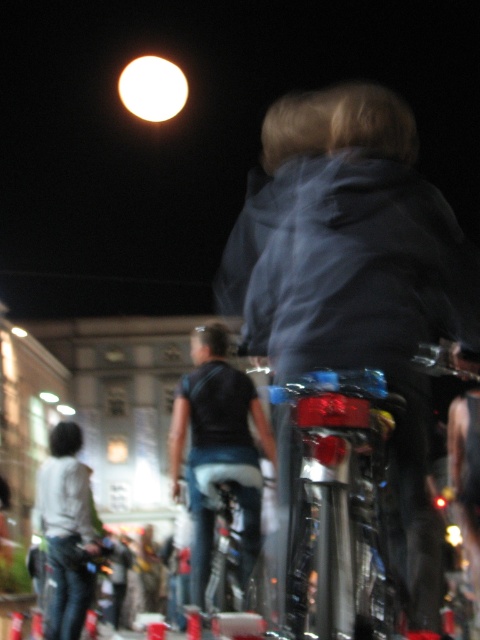
Does point (300, 134) lie behind point (252, 545)?

No, (300, 134) is in front of (252, 545).

Who is higher up, dark blue fabric jacket at center or black matte shirt at center?

dark blue fabric jacket at center is higher up.

Is point (464, 340) positioned behind point (263, 444)?

No, (464, 340) is closer to viewer.

Where is `dark blue fabric jacket at center`? This screenshot has height=640, width=480. dark blue fabric jacket at center is located at coordinates (356, 280).

Does dark blue fabric jacket at center have a lesser height compared to white matte shirt at lower left?

In fact, dark blue fabric jacket at center may be taller than white matte shirt at lower left.

You are a GUI agent. You are given a task and a screenshot of the screen. Output one action in this format:
    pyautogui.click(x=<x>, y=<y>)
    Task: Click on the dark blue fabric jacket at center
    This screenshot has height=640, width=480.
    Given the screenshot: What is the action you would take?
    pyautogui.click(x=356, y=280)

Is black matte shirt at center in front of white matte shirt at lower left?

Yes, it is.

Identify the location of black matte shirt at center. (x=217, y=449).

Find the location of a particular element. Image resolution: width=480 pixels, height=640 pixels. black matte shirt at center is located at coordinates (217, 449).